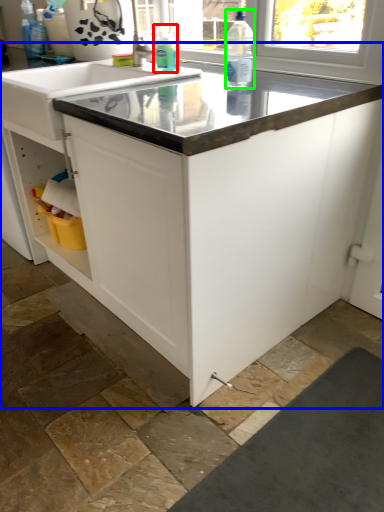
Question: Which object is the farthest from cleaning product (highlighted by a red box)? Choose among these: countertop (highlighted by a blue box) or bottle (highlighted by a green box).

Choices:
 (A) countertop
 (B) bottle

Answer: (A)